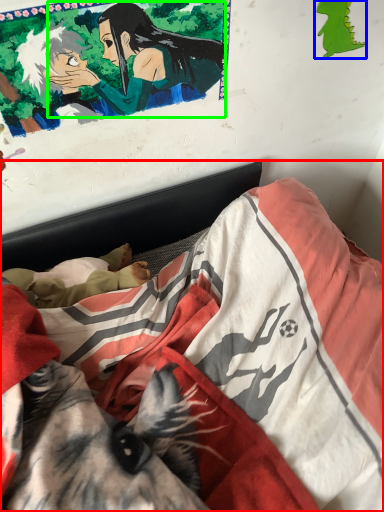
Question: Which object is the farthest from bed (highlighted by a red box)? Choose among these: art (highlighted by a blue box) or woman (highlighted by a green box).

Choices:
 (A) art
 (B) woman

Answer: (A)